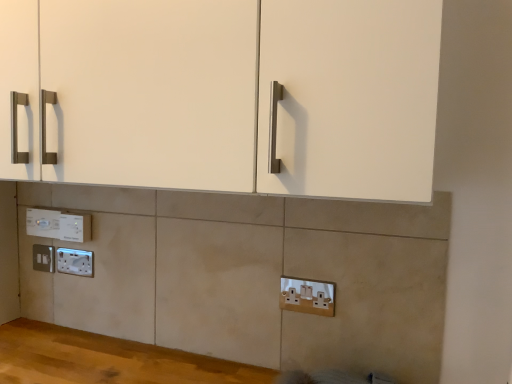
Question: Does white plastic socket at lower center, which ranks as the 1th electric outlet in front-to-back order, come in front of white plastic socket at lower left, acting as the third electric outlet starting from the left?

Choices:
 (A) yes
 (B) no

Answer: (A)

Question: Considering the relative sizes of white plastic socket at lower center, arranged as the 5th electric outlet when viewed from the left, and white plastic socket at lower left, the third electric outlet in the back-to-front sequence, in the image provided, is white plastic socket at lower center, arranged as the 5th electric outlet when viewed from the left, thinner than white plastic socket at lower left, the third electric outlet in the back-to-front sequence,?

Choices:
 (A) yes
 (B) no

Answer: (B)

Question: From the image's perspective, would you say white plastic socket at lower center, arranged as the 5th electric outlet when viewed from the left, is shown under white plastic socket at lower left, the third electric outlet positioned from the right?

Choices:
 (A) yes
 (B) no

Answer: (A)

Question: Does white plastic socket at lower center, which is the fifth electric outlet in back-to-front order, have a greater width compared to white plastic socket at lower left, acting as the third electric outlet starting from the left?

Choices:
 (A) no
 (B) yes

Answer: (B)

Question: Is white plastic socket at lower center, which is the fifth electric outlet in back-to-front order, facing away from white plastic socket at lower left, which is counted as the third electric outlet, starting from the front?

Choices:
 (A) yes
 (B) no

Answer: (B)

Question: Is white plastic socket at lower center, which is the fifth electric outlet in back-to-front order, positioned behind white plastic socket at lower left, which is counted as the third electric outlet, starting from the front?

Choices:
 (A) yes
 (B) no

Answer: (B)

Question: From the image's perspective, is white plastic electric outlet at lower left, which appears as the second electric outlet when viewed from the left, located above white plastic socket at lower left, which is counted as the third electric outlet, starting from the front?

Choices:
 (A) yes
 (B) no

Answer: (A)

Question: Considering the relative positions of white plastic electric outlet at lower left, the second electric outlet viewed from the back, and white plastic socket at lower left, which is counted as the third electric outlet, starting from the front, in the image provided, is white plastic electric outlet at lower left, the second electric outlet viewed from the back, to the left of white plastic socket at lower left, which is counted as the third electric outlet, starting from the front, from the viewer's perspective?

Choices:
 (A) yes
 (B) no

Answer: (A)

Question: From a real-world perspective, does white plastic electric outlet at lower left, the second electric outlet viewed from the back, sit lower than white plastic socket at lower left, the third electric outlet in the back-to-front sequence?

Choices:
 (A) yes
 (B) no

Answer: (B)

Question: Does white plastic electric outlet at lower left, which appears as the second electric outlet when viewed from the left, lie behind white plastic socket at lower left, which is counted as the third electric outlet, starting from the front?

Choices:
 (A) no
 (B) yes

Answer: (B)

Question: Is white plastic electric outlet at lower left, which appears as the second electric outlet when viewed from the left, positioned in front of white plastic socket at lower left, acting as the third electric outlet starting from the left?

Choices:
 (A) yes
 (B) no

Answer: (B)

Question: Is white plastic electric outlet at lower left, which appears as the second electric outlet when viewed from the left, bigger than white plastic socket at lower left, which is counted as the third electric outlet, starting from the front?

Choices:
 (A) no
 (B) yes

Answer: (B)

Question: From a real-world perspective, is white plastic electric outlet at lower left, positioned as the 1th electric outlet in back-to-front order, located higher than white plastic socket at lower center, the 1th electric outlet viewed from the right?

Choices:
 (A) yes
 (B) no

Answer: (A)